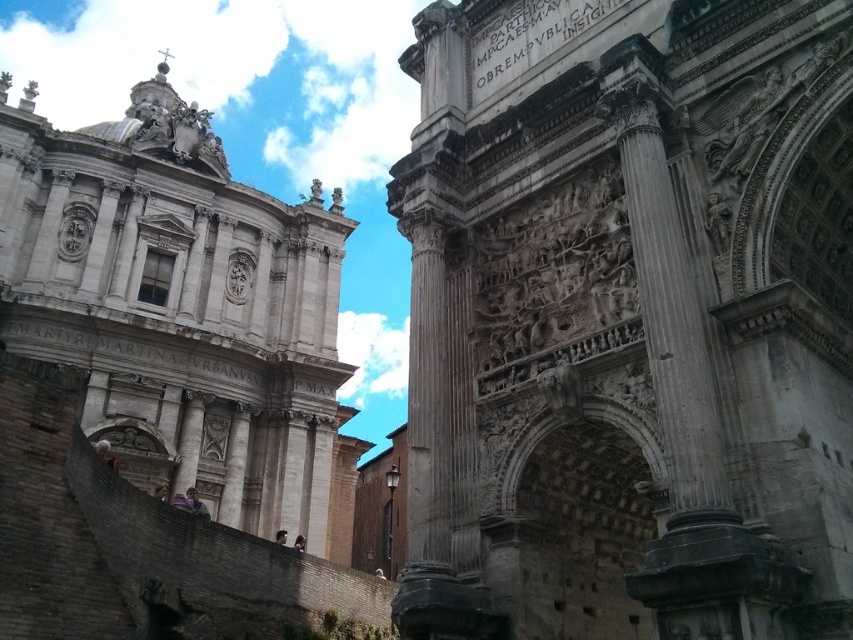
You are an architect analyzing the spatial layout of this historical site. Based on the image, which structure is positioned closer to the observer, the gray stone arch at center or the white stone tower at upper left?

The gray stone arch at center is closer to the viewer than the white stone tower at upper left.